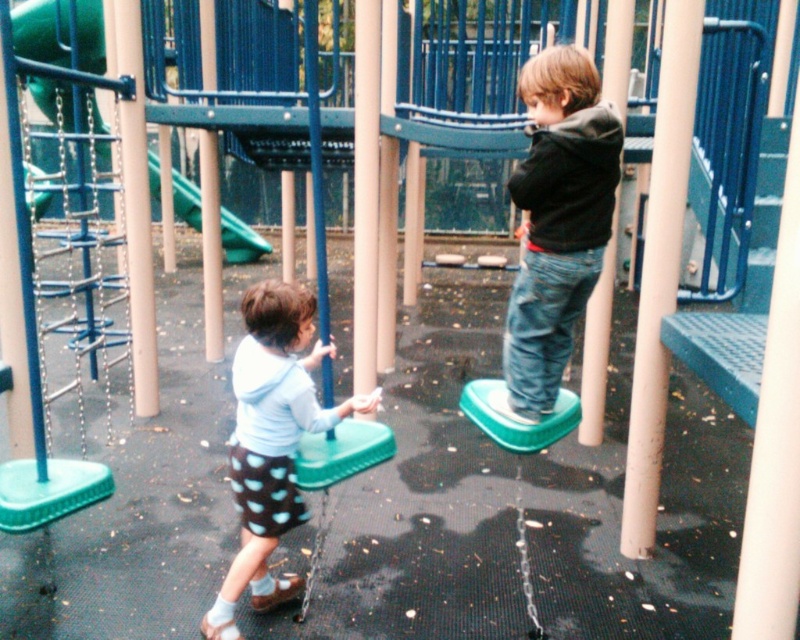
Can you confirm if dark gray hoodie at center is positioned above green rubber slide at upper left?

Incorrect, dark gray hoodie at center is not positioned above green rubber slide at upper left.

Does dark gray hoodie at center have a smaller size compared to green rubber slide at upper left?

Yes.

Between point (562, 321) and point (262, 241), which one is positioned in front?

Point (562, 321) is in front.

The height and width of the screenshot is (640, 800). Identify the location of dark gray hoodie at center. (558, 221).

Which is above, dark gray hoodie at center or green plastic swing at center?

dark gray hoodie at center is above.

Is dark gray hoodie at center shorter than green plastic swing at center?

Indeed, dark gray hoodie at center has a lesser height compared to green plastic swing at center.

Who is more distant from viewer, (x=564, y=88) or (x=302, y=460)?

The point (x=302, y=460) is behind.

The height and width of the screenshot is (640, 800). I want to click on dark gray hoodie at center, so click(x=558, y=221).

Is white matte shirt at center further to camera compared to green rubber slide at upper left?

No, it is in front of green rubber slide at upper left.

In the scene shown: Is white matte shirt at center thinner than green rubber slide at upper left?

Incorrect, white matte shirt at center's width is not less than green rubber slide at upper left's.

Who is more distant from viewer, (312, 387) or (148, 177)?

Point (148, 177)

Identify the location of white matte shirt at center. This screenshot has height=640, width=800. (272, 442).